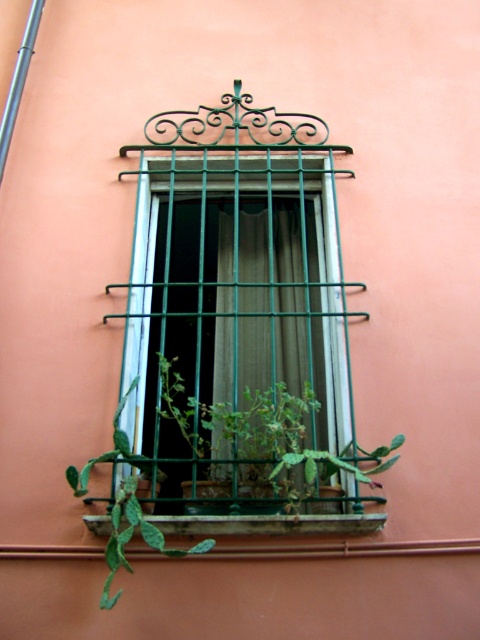
Question: Can you confirm if green metal window at center is positioned below green spiky cactus at lower left?

Choices:
 (A) no
 (B) yes

Answer: (A)

Question: Which point appears farthest from the camera in this image?

Choices:
 (A) (252, 528)
 (B) (116, 451)
 (C) (151, 337)

Answer: (C)

Question: Estimate the real-world distances between objects in this image. Which object is closer to the green spiky cactus at lower left?

Choices:
 (A) green metal window at center
 (B) green sheer curtain at center

Answer: (B)

Question: Where is green metal window at center located in relation to green sheer curtain at center in the image?

Choices:
 (A) left
 (B) right

Answer: (A)

Question: Which point appears closest to the camera in this image?

Choices:
 (A) (236, 248)
 (B) (106, 600)

Answer: (B)

Question: Can you confirm if green metal window at center is positioned to the right of green spiky cactus at lower left?

Choices:
 (A) no
 (B) yes

Answer: (B)